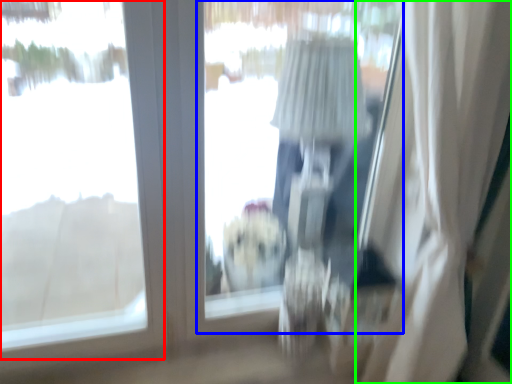
Question: Which is nearer to the window (highlighted by a red box)? window screen (highlighted by a blue box) or curtain (highlighted by a green box).

Choices:
 (A) window screen
 (B) curtain

Answer: (A)